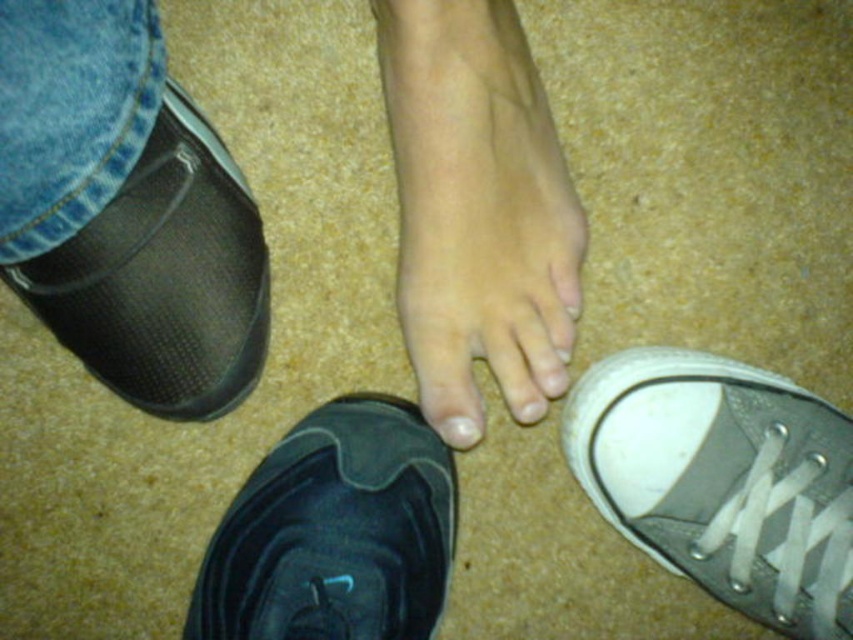
Question: Is black mesh shoe at lower left bigger than white matte toe at center?

Choices:
 (A) yes
 (B) no

Answer: (A)

Question: Does black suede shoe at center come in front of black mesh shoe at lower left?

Choices:
 (A) no
 (B) yes

Answer: (A)

Question: Considering the real-world distances, which object is closest to the gray canvas shoe at lower right?

Choices:
 (A) black mesh shoe at lower left
 (B) white matte nail at center
 (C) white matte toe at center

Answer: (C)

Question: Can you confirm if matte black shoe at lower center is positioned above white matte nail at center?

Choices:
 (A) yes
 (B) no

Answer: (A)

Question: Which point is closer to the camera?

Choices:
 (A) (525, 404)
 (B) (457, 433)
 (C) (415, 460)

Answer: (B)

Question: Which object is farther from the camera taking this photo?

Choices:
 (A) black mesh shoe at lower left
 (B) gray canvas shoe at lower right
 (C) white matte nail at center

Answer: (B)